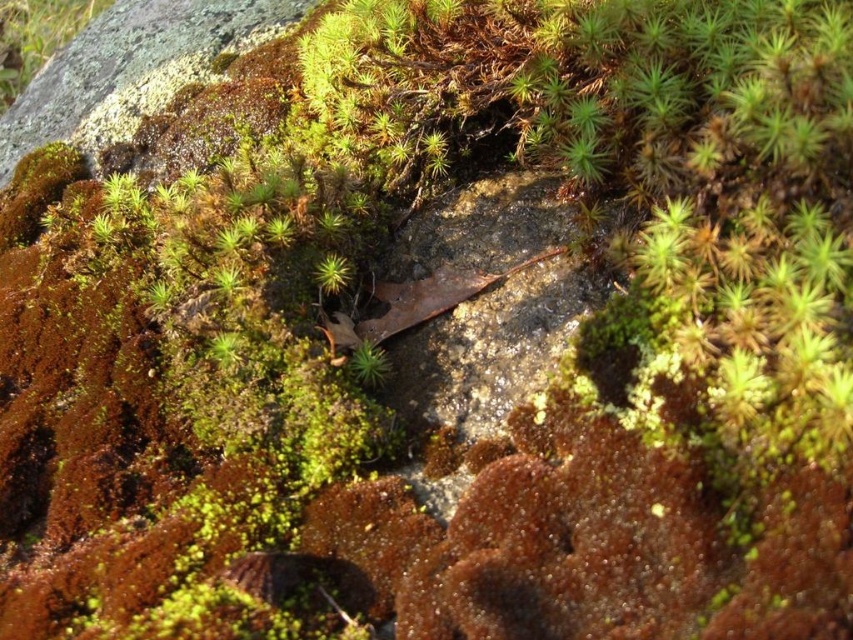
You are a botanist studying the spatial distribution of mosses on a rock. You need to collect samples from both the green mossy plant at upper left and the green fuzzy moss at center. Given that your collection kit can only reach up to 2 meters, will you be able to collect both samples without moving the kit?

The green mossy plant at upper left is 2.64 meters from the green fuzzy moss at center. Since the distance exceeds the 2 meters reach of the collection kit, you will not be able to collect both samples without moving the kit.

You are standing at point A and want to reach point B on the same rock surface. The coordinates of point A are (61,3) and point B are 0.008, 0.075. According to the image, how far apart are these two points?

The two points are 3.00 meters apart.

You are a botanist examining the rock surface. You notice the green mossy plant at upper left and the green fuzzy moss at center. Which one is positioned higher on the rock surface?

The green mossy plant at upper left is positioned higher on the rock surface than the green fuzzy moss at center.